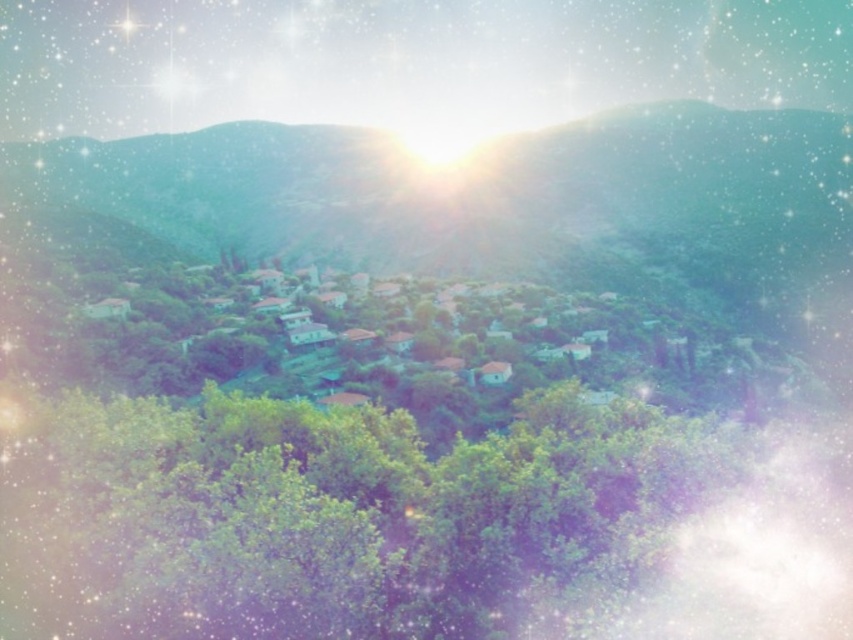
Is green leafy tree at lower left taller than green matte hillside at center?

No, green leafy tree at lower left is not taller than green matte hillside at center.

The width and height of the screenshot is (853, 640). I want to click on green leafy tree at lower left, so click(334, 516).